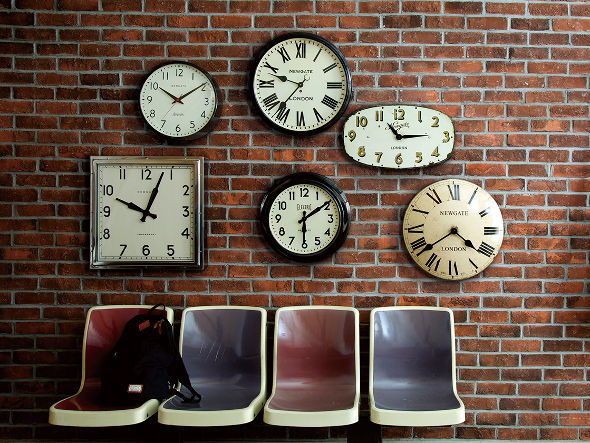
I want to click on chairs, so click(131, 368), click(222, 363), click(319, 376), click(417, 376).